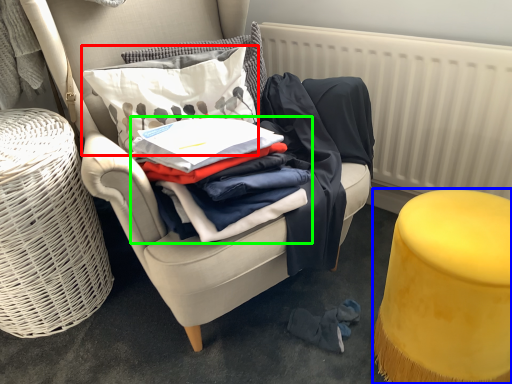
Question: Estimate the real-world distances between objects in this image. Which object is farther from pillow (highlighted by a red box), stool (highlighted by a blue box) or clothing (highlighted by a green box)?

Choices:
 (A) stool
 (B) clothing

Answer: (A)